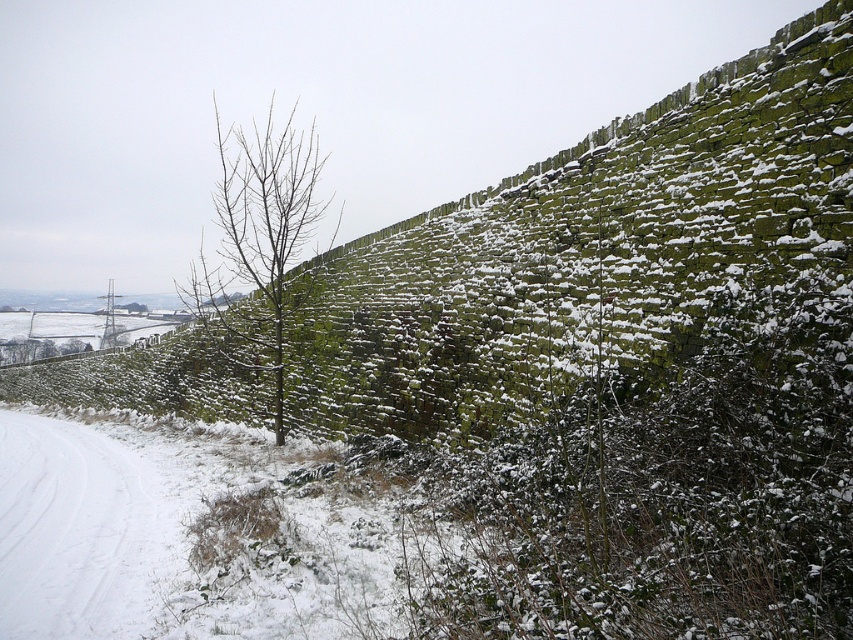
From the picture: You are standing at the bottom left corner of the image and want to walk towards the bare branches at center. Which direction should you move relative to the white snow at lower left?

To reach the bare branches at center from the bottom left corner, you should move to the left of the white snow at lower left since the white snow at lower left is positioned to the right of the bare branches at center.

You are a delivery robot with a 30 feet battery range. You are currently at the green mossy hedge at center and need to reach the white snow at lower left. Can you make the trip without recharging?

The distance between the green mossy hedge at center and the white snow at lower left is 26.97 feet, which is within the robot battery range of 30 feet. Yes, the robot can make the trip without recharging.